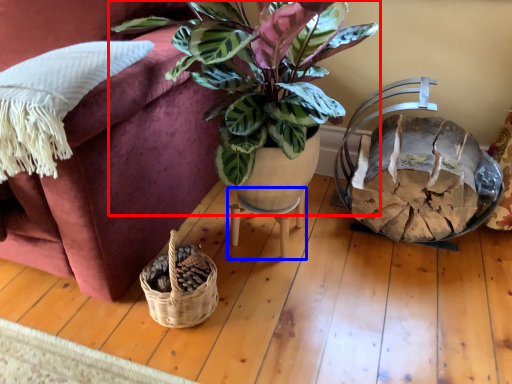
Question: Which object is further to the camera taking this photo, houseplant (highlighted by a red box) or table (highlighted by a blue box)?

Choices:
 (A) houseplant
 (B) table

Answer: (B)